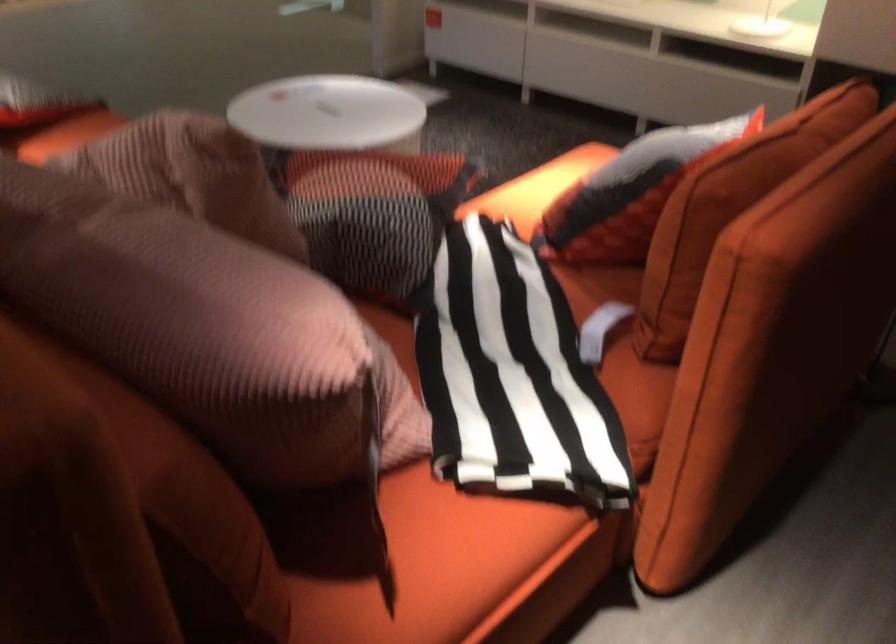
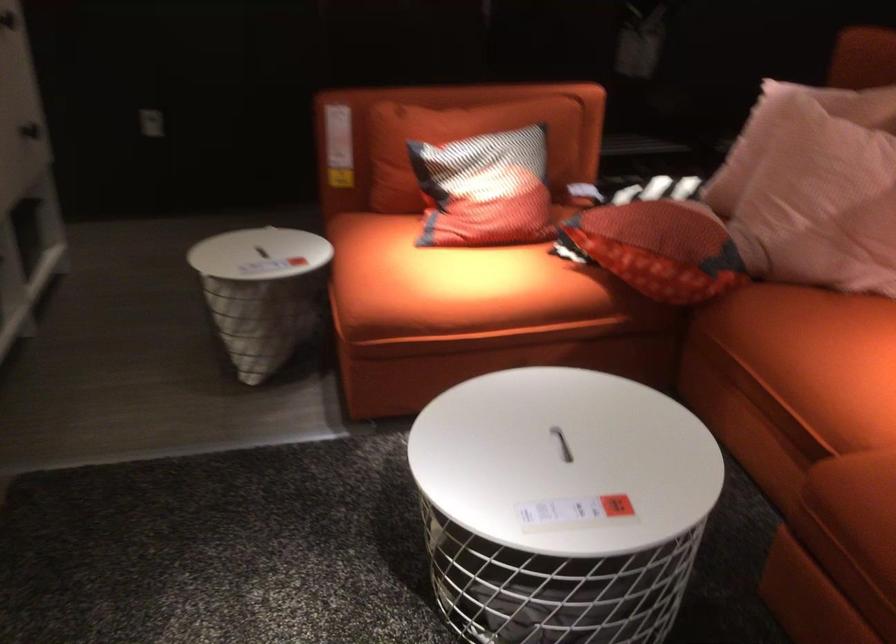
The point at (340, 156) is marked in the first image. Where is the corresponding point in the second image?

(659, 248)